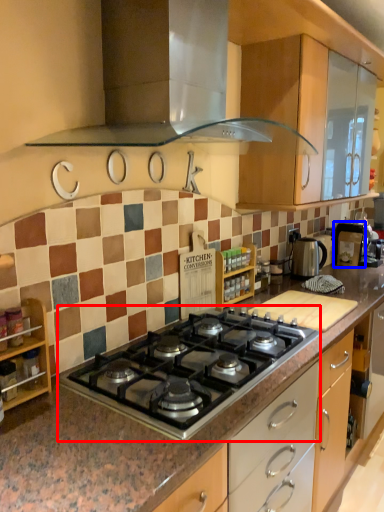
Question: Which of the following is the farthest to the observer, gas stove (highlighted by a red box) or appliance (highlighted by a blue box)?

Choices:
 (A) gas stove
 (B) appliance

Answer: (B)